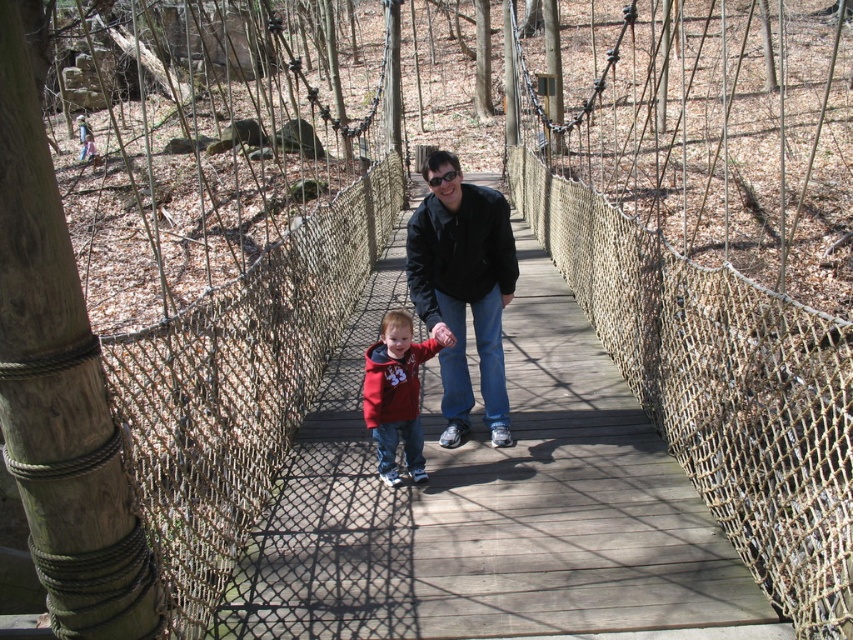
Question: Is matte black jacket at center positioned in front of matte red hoodie at center?

Choices:
 (A) yes
 (B) no

Answer: (A)

Question: Considering the relative positions of matte black jacket at center and matte red hoodie at center in the image provided, where is matte black jacket at center located with respect to matte red hoodie at center?

Choices:
 (A) left
 (B) right

Answer: (B)

Question: Which of the following is the farthest from the observer?

Choices:
 (A) (450, 177)
 (B) (399, 426)

Answer: (B)

Question: Which point is farther from the camera taking this photo?

Choices:
 (A) (405, 420)
 (B) (461, 224)

Answer: (B)

Question: Which point is farther from the camera taking this photo?

Choices:
 (A) [x=505, y=429]
 (B) [x=375, y=365]

Answer: (A)

Question: In this image, where is matte black jacket at center located relative to matte red hoodie at center?

Choices:
 (A) right
 (B) left

Answer: (A)